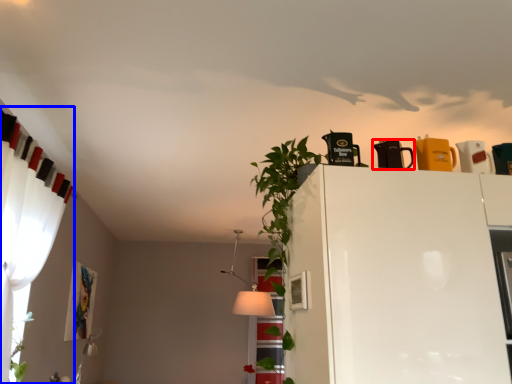
Question: Among these objects, which one is farthest to the camera, appliance (highlighted by a red box) or curtain (highlighted by a blue box)?

Choices:
 (A) appliance
 (B) curtain

Answer: (A)